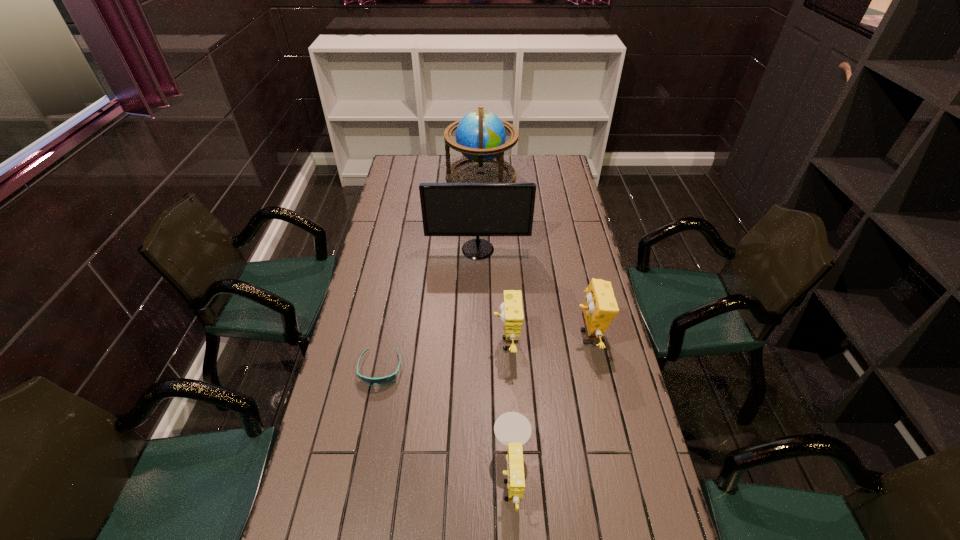
Find the location of `free space at the left edge`. free space at the left edge is located at coordinates (407, 263).

Where is `vacant space at the right edge of the desktop`? vacant space at the right edge of the desktop is located at coordinates (584, 245).

This screenshot has height=540, width=960. In order to click on vacant space at the far right corner of the desktop in this screenshot , I will do `click(544, 161)`.

At what (x,y) coordinates should I click in order to perform the action: click on free space that is in between the second tallest object and the rightmost object. Please return your answer as a coordinate pair (x, y). Image resolution: width=960 pixels, height=540 pixels. Looking at the image, I should click on (533, 293).

Find the location of a particular element. vacant space in between the globe and the shortest sponge is located at coordinates (496, 327).

Locate an element on the screen. vacant area that lies between the leftmost object and the second farthest object is located at coordinates coord(429,309).

Find the location of a particular element. empty space between the rightmost sponge and the sunglasses is located at coordinates (484, 353).

Choose which object is the second nearest neighbor to the rightmost sponge. Please provide its 2D coordinates. Your answer should be formatted as a tuple, i.e. [(x, y)], where the tuple contains the x and y coordinates of a point satisfying the conditions above.

[(512, 429)]

Select which object appears as the closest to the farthest object. Please provide its 2D coordinates. Your answer should be formatted as a tuple, i.e. [(x, y)], where the tuple contains the x and y coordinates of a point satisfying the conditions above.

[(448, 209)]

Identify which sponge is the second nearest to the rightmost sponge. Please provide its 2D coordinates. Your answer should be formatted as a tuple, i.e. [(x, y)], where the tuple contains the x and y coordinates of a point satisfying the conditions above.

[(512, 429)]